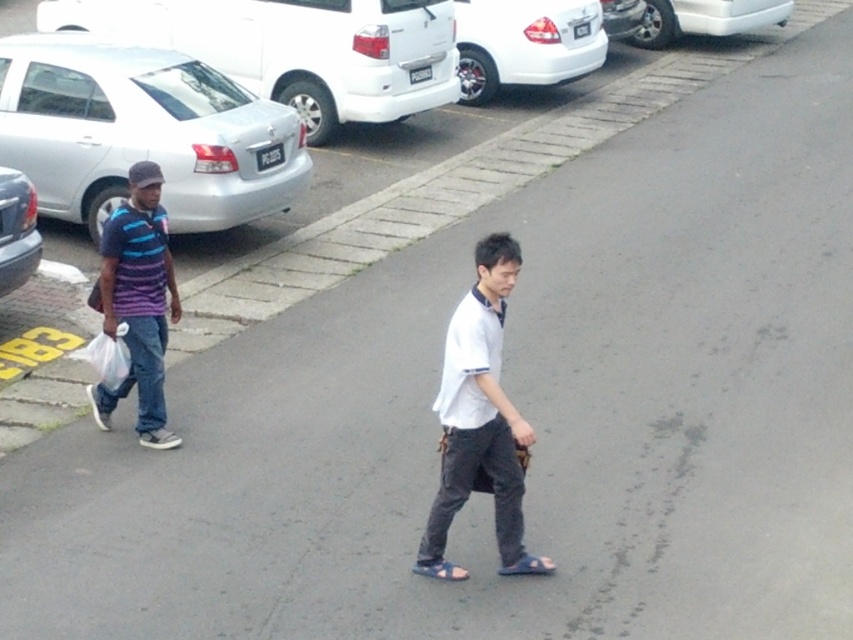
Between silver metallic sedan at left and matte silver car at left, which one is positioned higher?

silver metallic sedan at left is above.

At what (x,y) coordinates should I click in order to perform the action: click on silver metallic sedan at left. Please return your answer as a coordinate pair (x, y). The image size is (853, 640). Looking at the image, I should click on click(x=143, y=132).

Which is behind, point (94, 364) or point (421, 573)?

Point (94, 364)

Does white plastic bag at left appear on the right side of blue fabric sandal at lower center?

No, white plastic bag at left is not to the right of blue fabric sandal at lower center.

Who is more forward, [108,385] or [426,573]?

Positioned in front is point [426,573].

Find the location of a particular element. The width and height of the screenshot is (853, 640). white plastic bag at left is located at coordinates (107, 356).

Is white glossy sedan at upper center shorter than blue rubber sandal at lower center?

In fact, white glossy sedan at upper center may be taller than blue rubber sandal at lower center.

I want to click on white glossy sedan at upper center, so click(525, 44).

At what (x,y) coordinates should I click in order to perform the action: click on white glossy sedan at upper center. Please return your answer as a coordinate pair (x, y). The height and width of the screenshot is (640, 853). Looking at the image, I should click on (525, 44).